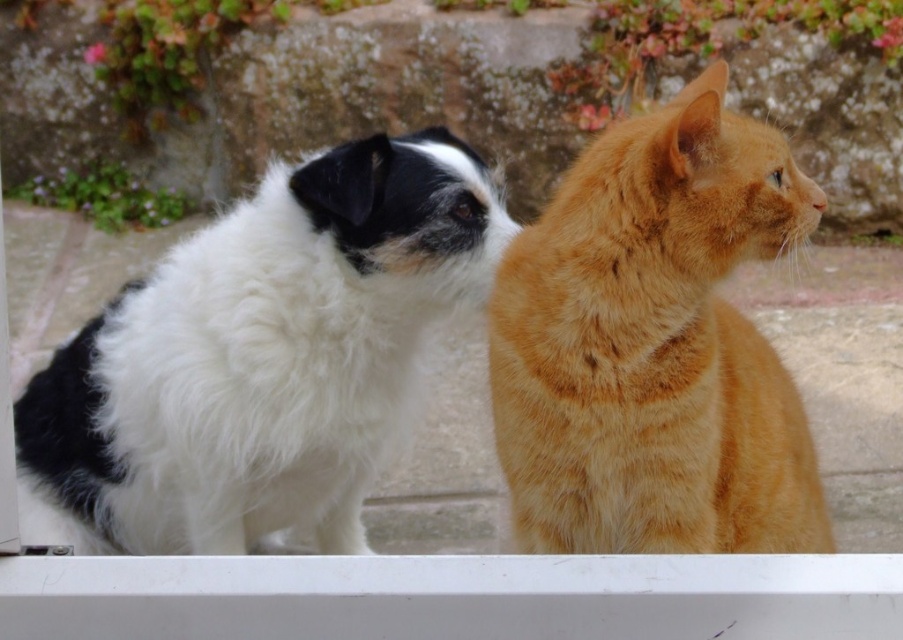
Question: From the image, what is the correct spatial relationship of white fluffy dog at left in relation to orange fur cat at right?

Choices:
 (A) left
 (B) right

Answer: (A)

Question: Can you confirm if white fluffy dog at left is thinner than orange fur cat at right?

Choices:
 (A) no
 (B) yes

Answer: (A)

Question: Which point is farther from the camera taking this photo?

Choices:
 (A) (196, 381)
 (B) (694, 449)

Answer: (A)

Question: Among these points, which one is farthest from the camera?

Choices:
 (A) (76, 497)
 (B) (739, 348)

Answer: (A)

Question: Is white fluffy dog at left thinner than orange fur cat at right?

Choices:
 (A) yes
 (B) no

Answer: (B)